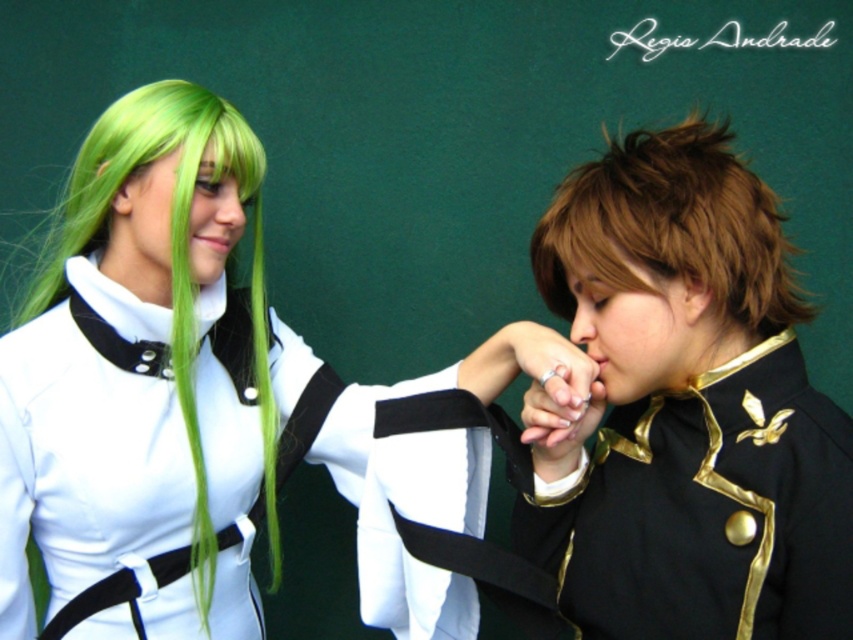
You are a costume designer trying to determine the spatial relationship between the matte white uniform at center and the green silky wig at left. Which object is wider in the image?

The matte white uniform at center is wider than the green silky wig at left according to the description.

You are a photographer trying to capture the perfect shot of the two cosplayers. You notice a specific point in the image at coordinates (177, 387). What object is located at this point?

The point at coordinates (177, 387) marks the matte white uniform at center.